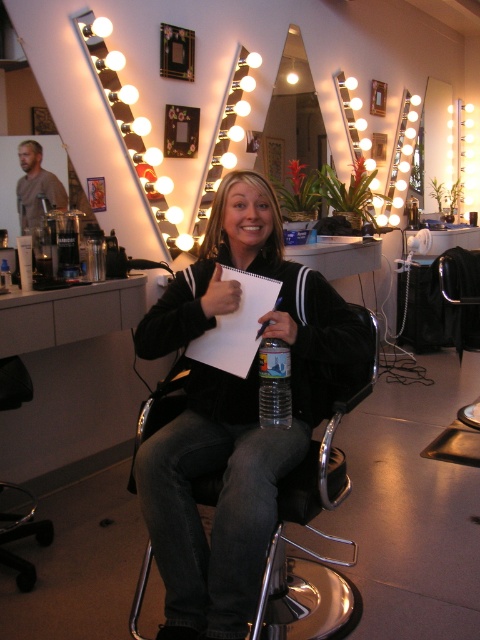
Question: Which object is positioned farthest from the black velvet jacket at center?

Choices:
 (A) clear plastic bottle at center
 (B) metallic silver swivel chair at lower left
 (C) blonde hair at center
 (D) matte brown hair at upper left

Answer: (D)

Question: Which object is closer to the camera taking this photo?

Choices:
 (A) blonde hair at center
 (B) clear plastic bottle at center
 (C) black velvet jacket at center
 (D) metallic silver swivel chair at lower left

Answer: (C)

Question: Can you confirm if metallic silver swivel chair at lower left is positioned to the right of matte brown hair at upper left?

Choices:
 (A) yes
 (B) no

Answer: (A)

Question: Does black velvet jacket at center have a greater width compared to blonde hair at center?

Choices:
 (A) no
 (B) yes

Answer: (B)

Question: Considering the real-world distances, which object is closest to the clear plastic bottle at center?

Choices:
 (A) blonde hair at center
 (B) matte brown hair at upper left
 (C) black velvet jacket at center

Answer: (C)

Question: Is the position of black velvet jacket at center more distant than that of clear plastic bottle at center?

Choices:
 (A) yes
 (B) no

Answer: (B)